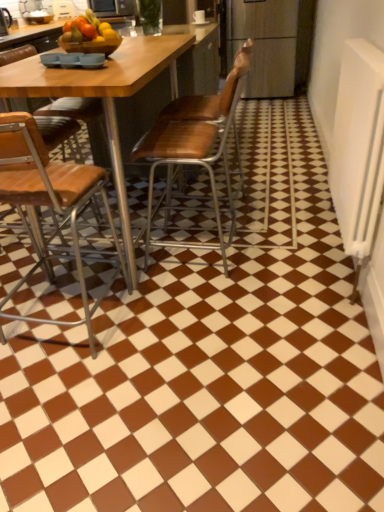
I want to click on free space in front of brown leather chair at left, acting as the third chair starting from the right, so click(x=102, y=430).